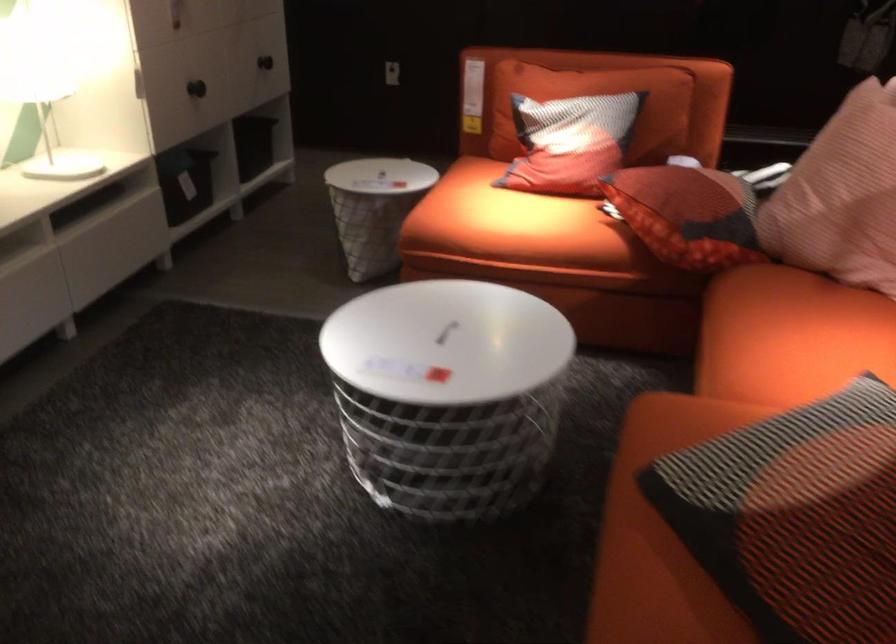
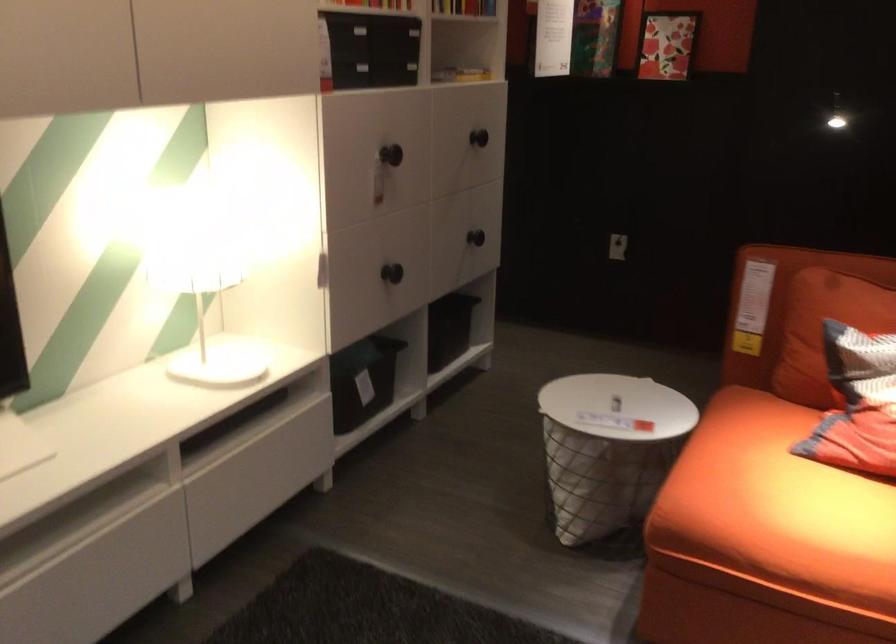
Question: What movement of the cameraman would produce the second image?

Choices:
 (A) Left
 (B) Right
 (C) Forward
 (D) Backward

Answer: (C)